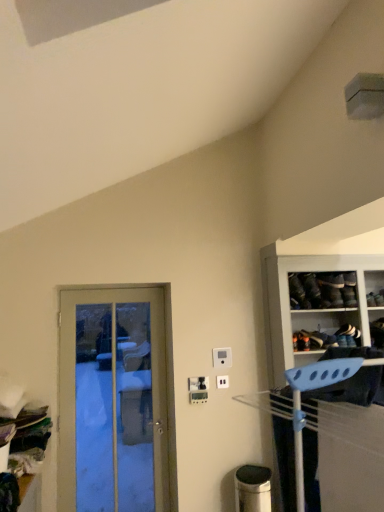
Question: Is white plastic electric outlet at center, the 2th electric outlet positioned from the bottom, spatially inside blue plastic hanger at right, or outside of it?

Choices:
 (A) inside
 (B) outside

Answer: (B)

Question: Considering the positions of white plastic electric outlet at center, the 2th electric outlet positioned from the bottom, and blue plastic hanger at right in the image, is white plastic electric outlet at center, the 2th electric outlet positioned from the bottom, bigger or smaller than blue plastic hanger at right?

Choices:
 (A) big
 (B) small

Answer: (B)

Question: Based on their relative distances, which object is farther from the white plastic electric outlet at center, the first electric outlet from the top?

Choices:
 (A) wooden door at left
 (B) white plastic electric outlet at center, the 1th electric outlet ordered from the bottom
 (C) blue plastic hanger at right
 (D) white plastic electric outlet at center, the 2th electric outlet positioned from the bottom
 (E) leather black shoe at upper right, positioned as the first shoe in top-to-bottom order

Answer: (A)

Question: Which of these objects is positioned closest to the white plastic electric outlet at center, which is the third electric outlet in bottom-to-top order?

Choices:
 (A) white plastic electric outlet at center, the 1th electric outlet ordered from the bottom
 (B) white leather shoe at upper right, acting as the 1th shoe starting from the right
 (C) white plastic electric outlet at center, the 2th electric outlet positioned from the bottom
 (D) blue plastic hanger at right
 (E) wooden door at left

Answer: (A)